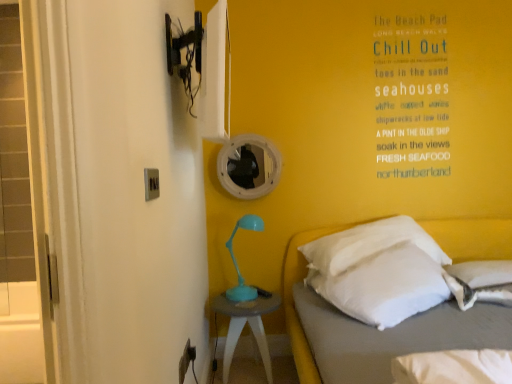
Question: Does white soft pillow at lower right, which is counted as the first pillow, starting from the right, have a larger size compared to white soft pillow at right, which ranks as the second pillow in right-to-left order?

Choices:
 (A) yes
 (B) no

Answer: (B)

Question: Considering the relative sizes of white soft pillow at lower right, which ranks as the second pillow in left-to-right order, and white soft pillow at right, arranged as the first pillow when viewed from the left, in the image provided, is white soft pillow at lower right, which ranks as the second pillow in left-to-right order, taller than white soft pillow at right, arranged as the first pillow when viewed from the left,?

Choices:
 (A) no
 (B) yes

Answer: (A)

Question: Is white soft pillow at lower right, which ranks as the second pillow in left-to-right order, next to white soft pillow at right, arranged as the first pillow when viewed from the left, and touching it?

Choices:
 (A) no
 (B) yes

Answer: (A)

Question: Would you say white soft pillow at lower right, which ranks as the second pillow in left-to-right order, is a long distance from white soft pillow at right, which ranks as the second pillow in right-to-left order?

Choices:
 (A) no
 (B) yes

Answer: (A)

Question: Does white soft pillow at lower right, which is counted as the first pillow, starting from the right, appear on the left side of white soft pillow at right, arranged as the first pillow when viewed from the left?

Choices:
 (A) no
 (B) yes

Answer: (A)

Question: From the image's perspective, is white soft pillow at lower right, which is counted as the first pillow, starting from the right, located beneath white soft pillow at right, arranged as the first pillow when viewed from the left?

Choices:
 (A) yes
 (B) no

Answer: (A)

Question: Considering the relative sizes of white soft bed at lower right and white soft pillow at lower right, which is counted as the first pillow, starting from the right, in the image provided, is white soft bed at lower right thinner than white soft pillow at lower right, which is counted as the first pillow, starting from the right,?

Choices:
 (A) no
 (B) yes

Answer: (A)

Question: Is the depth of white soft bed at lower right less than that of white soft pillow at lower right, which is counted as the first pillow, starting from the right?

Choices:
 (A) yes
 (B) no

Answer: (A)

Question: Is white soft bed at lower right placed right next to white soft pillow at lower right, which is counted as the first pillow, starting from the right?

Choices:
 (A) yes
 (B) no

Answer: (B)

Question: Considering the relative sizes of white soft bed at lower right and white soft pillow at lower right, which ranks as the second pillow in left-to-right order, in the image provided, is white soft bed at lower right smaller than white soft pillow at lower right, which ranks as the second pillow in left-to-right order,?

Choices:
 (A) no
 (B) yes

Answer: (A)

Question: Would you consider white soft bed at lower right to be distant from white soft pillow at lower right, which ranks as the second pillow in left-to-right order?

Choices:
 (A) no
 (B) yes

Answer: (A)

Question: Is white soft bed at lower right bigger than white soft pillow at lower right, which is counted as the first pillow, starting from the right?

Choices:
 (A) no
 (B) yes

Answer: (B)

Question: Is white soft pillow at right, which ranks as the second pillow in right-to-left order, further to camera compared to white soft bed at lower right?

Choices:
 (A) yes
 (B) no

Answer: (A)